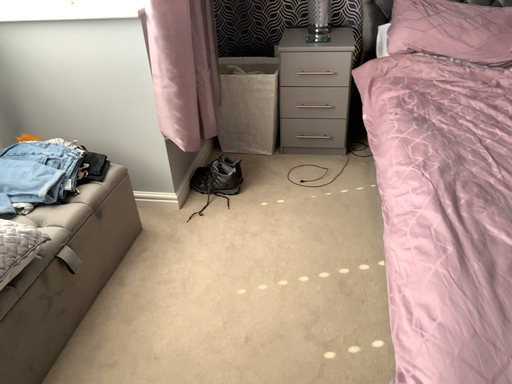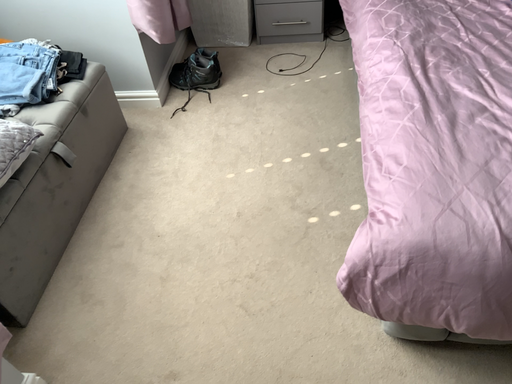
Question: How did the camera likely rotate when shooting the video?

Choices:
 (A) rotated downward
 (B) rotated upward

Answer: (A)